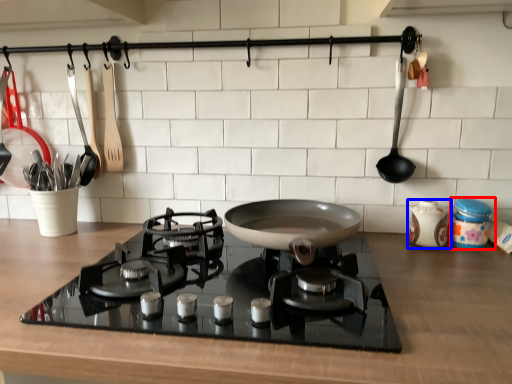
Question: Among these objects, which one is nearest to the camera, kitchen appliance (highlighted by a red box) or kitchen appliance (highlighted by a blue box)?

Choices:
 (A) kitchen appliance
 (B) kitchen appliance

Answer: (A)